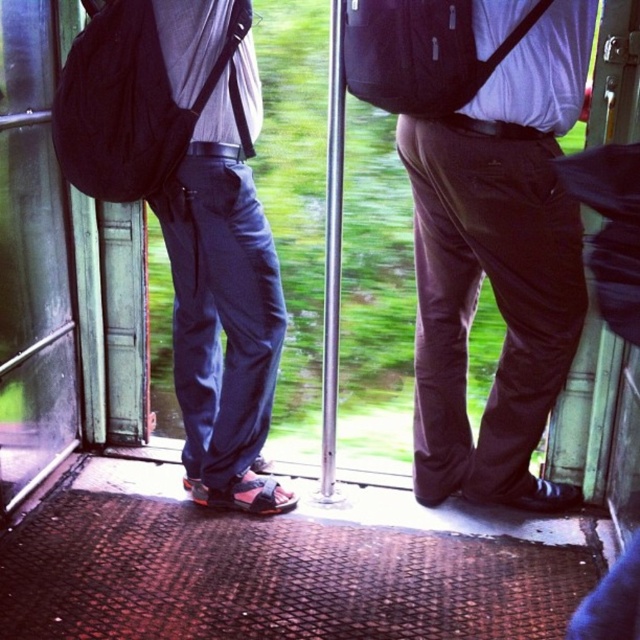
The image size is (640, 640). Describe the element at coordinates (124, 104) in the screenshot. I see `matte black backpack at left` at that location.

Does matte black backpack at left come behind matte black backpack at center?

Yes.

This screenshot has height=640, width=640. Identify the location of matte black backpack at left. (124, 104).

Locate an element on the screen. The height and width of the screenshot is (640, 640). matte black backpack at left is located at coordinates (124, 104).